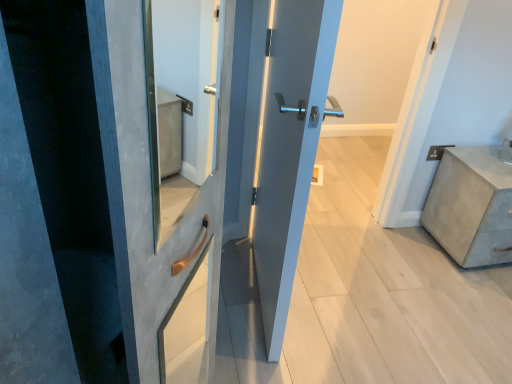
Locate an element on the screen. This screenshot has width=512, height=384. free point to the right of satin blue door at center is located at coordinates (342, 314).